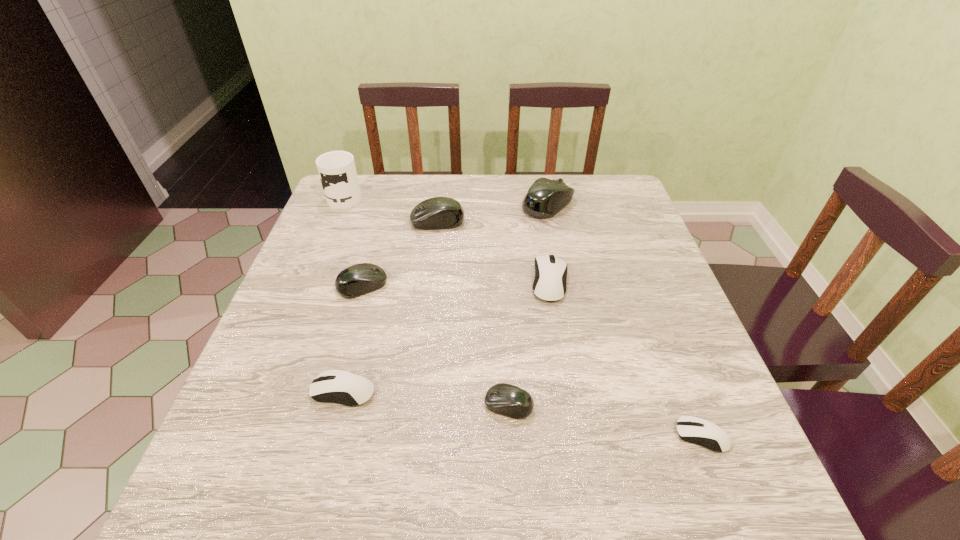
The width and height of the screenshot is (960, 540). Find the location of `white mug`. white mug is located at coordinates (337, 171).

Identify the location of mug. (337, 171).

Find the location of `the seventh shortest object`. the seventh shortest object is located at coordinates (545, 198).

Locate an element on the screen. Image resolution: width=960 pixels, height=540 pixels. the rightmost black mouse is located at coordinates (545, 198).

Find the location of `the fourth object from left to right`. the fourth object from left to right is located at coordinates 439,212.

At what (x,y) coordinates should I click in order to perform the action: click on the third tallest object. Please return your answer as a coordinate pair (x, y). Looking at the image, I should click on (439, 212).

At what (x,y) coordinates should I click in order to perform the action: click on the second white mouse from right to left. Please return your answer as a coordinate pair (x, y). Image resolution: width=960 pixels, height=540 pixels. Looking at the image, I should click on (550, 283).

Image resolution: width=960 pixels, height=540 pixels. I want to click on the farthest white mouse, so click(x=550, y=283).

This screenshot has width=960, height=540. What are the coordinates of `the third biggest black mouse` in the screenshot? It's located at (359, 279).

Where is `the third farthest black mouse`? This screenshot has width=960, height=540. the third farthest black mouse is located at coordinates (359, 279).